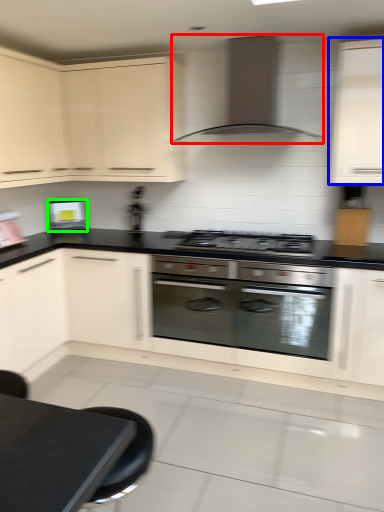
Question: Which object is the closest to the home appliance (highlighted by a red box)? Choose among these: cabinetry (highlighted by a blue box) or kitchen appliance (highlighted by a green box).

Choices:
 (A) cabinetry
 (B) kitchen appliance

Answer: (A)